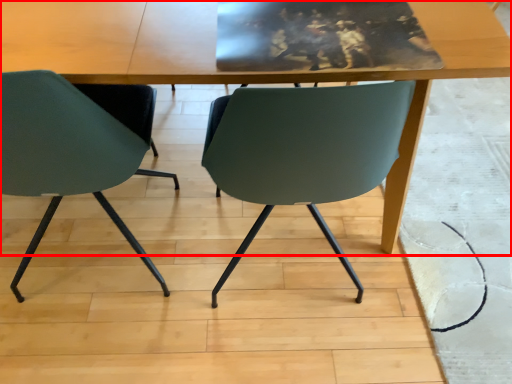
Question: Observing the image, what is the correct spatial positioning of table (annotated by the red box) in reference to chair?

Choices:
 (A) right
 (B) left

Answer: (A)